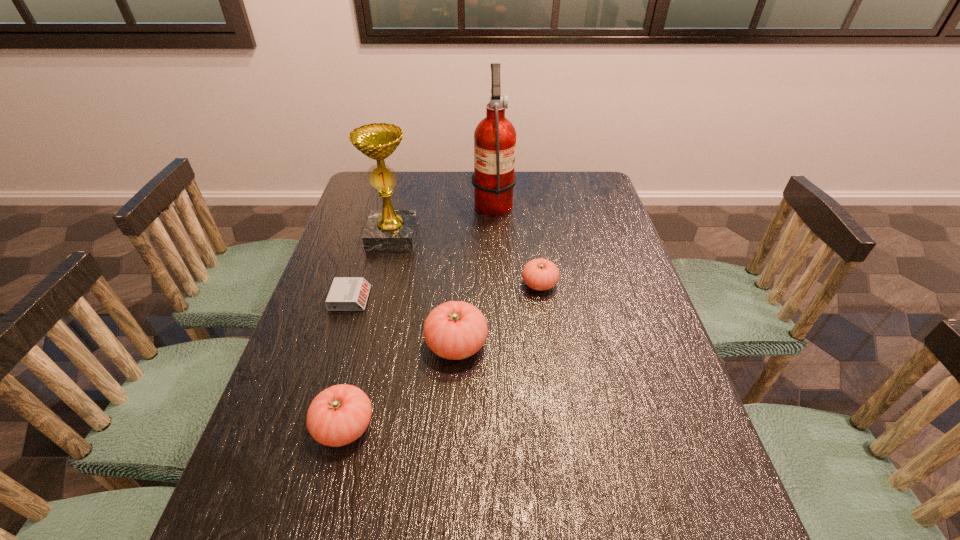
In order to click on empty location between the award and the second nearest object in this screenshot , I will do `click(424, 291)`.

Image resolution: width=960 pixels, height=540 pixels. What are the coordinates of `empty location between the fifth shortest object and the tallest tomato` in the screenshot? It's located at tap(424, 291).

The image size is (960, 540). In order to click on vacant space in between the second nearest object and the second farthest object in this screenshot , I will do `click(424, 291)`.

Find the location of a particular element. The width and height of the screenshot is (960, 540). free point between the farthest tomato and the shortest object is located at coordinates (444, 291).

This screenshot has height=540, width=960. What are the coordinates of `vacant point located between the third tallest object and the award` in the screenshot? It's located at (424, 291).

Identify the location of free space between the shortest object and the nearest object. (348, 362).

Identify the location of unoccupied area between the fourth shortest object and the rightmost tomato. The width and height of the screenshot is (960, 540). (498, 314).

The width and height of the screenshot is (960, 540). I want to click on vacant area that lies between the alarm clock and the nearest object, so click(x=348, y=362).

I want to click on free space that is in between the award and the farthest tomato, so click(x=466, y=260).

Identify which object is the nearest to the shortest object. Please provide its 2D coordinates. Your answer should be formatted as a tuple, i.e. [(x, y)], where the tuple contains the x and y coordinates of a point satisfying the conditions above.

[(388, 229)]